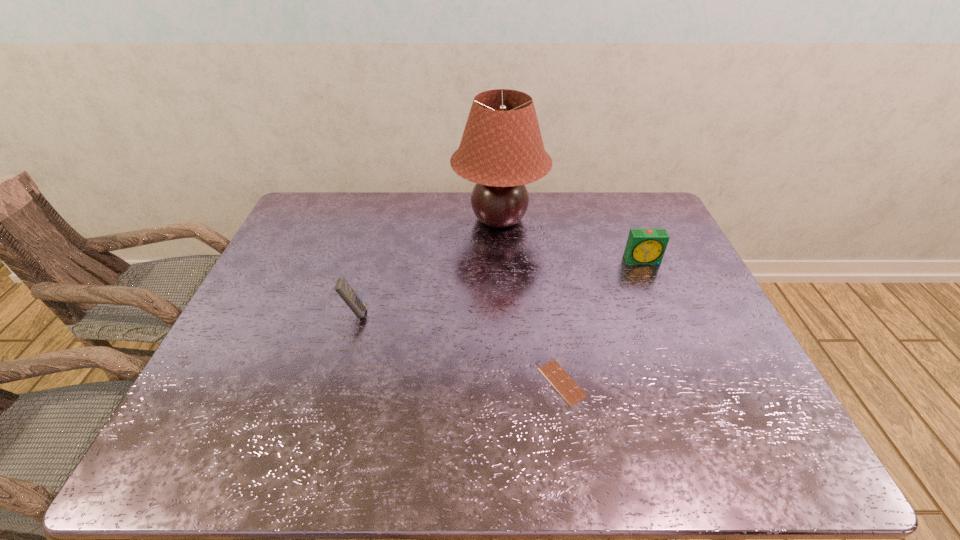
Locate an element on the screen. This screenshot has width=960, height=540. the farthest object is located at coordinates (501, 150).

Locate an element on the screen. lampshade is located at coordinates coord(501,150).

This screenshot has width=960, height=540. I want to click on the leftmost object, so click(x=343, y=288).

At what (x,y) coordinates should I click in order to perform the action: click on calculator. Please return your answer as a coordinate pair (x, y). Image resolution: width=960 pixels, height=540 pixels. Looking at the image, I should click on (343, 288).

Image resolution: width=960 pixels, height=540 pixels. I want to click on alarm clock, so click(644, 246).

You are a GUI agent. You are given a task and a screenshot of the screen. Output one action in this format:
    pyautogui.click(x=<x>, y=<y>)
    Task: Click on the rightmost object
    
    Given the screenshot: What is the action you would take?
    pyautogui.click(x=644, y=246)

The width and height of the screenshot is (960, 540). What are the coordinates of `chocolate bar` in the screenshot? It's located at (571, 392).

Locate an element on the screen. the shortest object is located at coordinates (571, 392).

The width and height of the screenshot is (960, 540). I want to click on vacant space situated 0.130m on the front-facing side of the tallest object, so click(x=415, y=219).

The height and width of the screenshot is (540, 960). Identify the location of vacant point located 0.080m on the front-facing side of the tallest object. (429, 219).